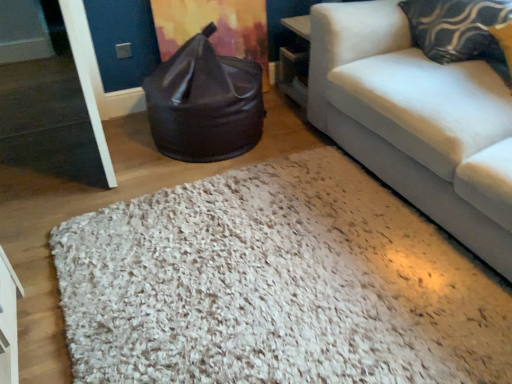
Question: Would you say black leather bean bag at center contains patterned fabric pillow at upper right?

Choices:
 (A) no
 (B) yes

Answer: (A)

Question: Can you confirm if black leather bean bag at center is shorter than patterned fabric pillow at upper right?

Choices:
 (A) yes
 (B) no

Answer: (B)

Question: Is black leather bean bag at center facing away from patterned fabric pillow at upper right?

Choices:
 (A) yes
 (B) no

Answer: (B)

Question: Is the depth of black leather bean bag at center greater than that of patterned fabric pillow at upper right?

Choices:
 (A) yes
 (B) no

Answer: (A)

Question: From a real-world perspective, is black leather bean bag at center over patterned fabric pillow at upper right?

Choices:
 (A) no
 (B) yes

Answer: (A)

Question: Is point (253, 77) closer or farther from the camera than point (274, 288)?

Choices:
 (A) closer
 (B) farther

Answer: (B)

Question: Is black leather bean bag at center in front of or behind white shaggy rug at center in the image?

Choices:
 (A) behind
 (B) front

Answer: (A)

Question: Is black leather bean bag at center situated inside white shaggy rug at center or outside?

Choices:
 (A) inside
 (B) outside

Answer: (B)

Question: Based on their positions, is black leather bean bag at center located to the left or right of white shaggy rug at center?

Choices:
 (A) right
 (B) left

Answer: (B)

Question: Based on their sizes in the image, would you say white shaggy rug at center is bigger or smaller than black leather bean bag at center?

Choices:
 (A) small
 (B) big

Answer: (A)

Question: From a real-world perspective, relative to black leather bean bag at center, is white shaggy rug at center vertically above or below?

Choices:
 (A) above
 (B) below

Answer: (B)

Question: Relative to black leather bean bag at center, is white shaggy rug at center in front or behind?

Choices:
 (A) front
 (B) behind

Answer: (A)

Question: From the image's perspective, relative to black leather bean bag at center, is white shaggy rug at center above or below?

Choices:
 (A) below
 (B) above

Answer: (A)

Question: Relative to black leather bean bag at center, is patterned fabric pillow at upper right in front or behind?

Choices:
 (A) front
 (B) behind

Answer: (A)

Question: From a real-world perspective, is patterned fabric pillow at upper right physically located above or below black leather bean bag at center?

Choices:
 (A) above
 (B) below

Answer: (A)